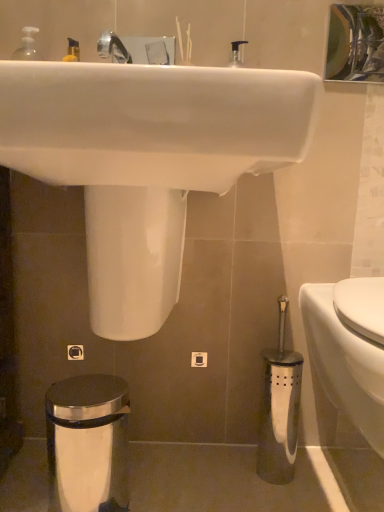
Question: Considering the relative positions of metallic silver toilet brush at lower right and white glossy toilet at lower right in the image provided, is metallic silver toilet brush at lower right to the left or to the right of white glossy toilet at lower right?

Choices:
 (A) right
 (B) left

Answer: (B)

Question: Is point click(x=268, y=361) positioned closer to the camera than point click(x=324, y=389)?

Choices:
 (A) farther
 (B) closer

Answer: (B)

Question: Estimate the real-world distances between objects in this image. Which object is closer to the metallic silver toilet brush at lower right?

Choices:
 (A) white glossy sink at upper center
 (B) satin chrome trash can at lower left
 (C) metallic reflective mirror at upper center
 (D) white glossy toilet at lower right

Answer: (D)

Question: Which object is the farthest from the white glossy toilet at lower right?

Choices:
 (A) satin chrome trash can at lower left
 (B) white glossy sink at upper center
 (C) metallic silver toilet brush at lower right
 (D) metallic reflective mirror at upper center

Answer: (D)